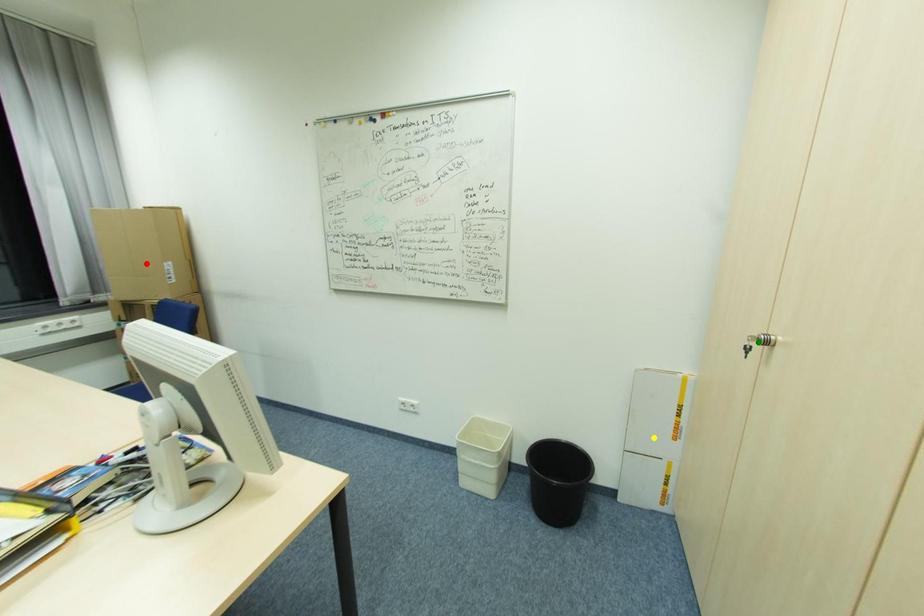
Order these from nearest to farthest:
A) green point
B) red point
C) yellow point

green point → yellow point → red point